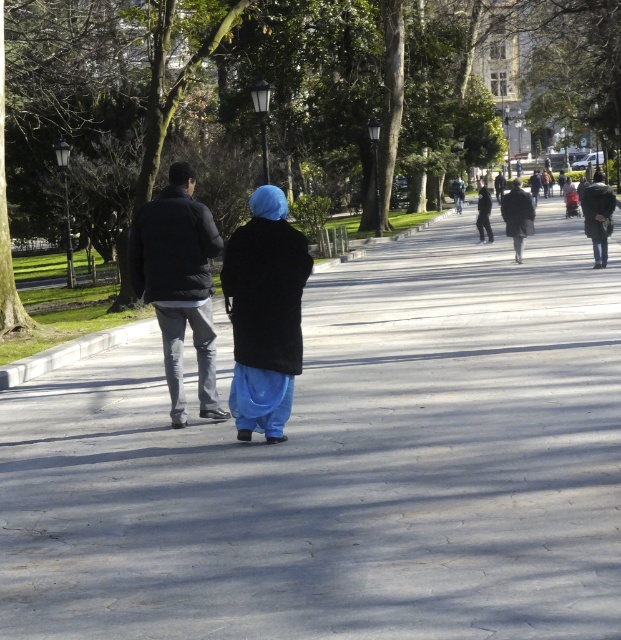
Can you confirm if green leafy tree at center is taller than dark gray jacket at center?

Indeed, green leafy tree at center has a greater height compared to dark gray jacket at center.

Image resolution: width=621 pixels, height=640 pixels. I want to click on green leafy tree at center, so click(x=283, y=96).

What are the coordinates of `green leafy tree at center` in the screenshot? It's located at (283, 96).

Between point (217, 410) and point (514, 237), which one is positioned behind?

Positioned behind is point (514, 237).

Is dark gray jacket at center to the right of dark gray coat at center from the viewer's perspective?

Incorrect, dark gray jacket at center is not on the right side of dark gray coat at center.

Who is more forward, (156,228) or (530,211)?

Positioned in front is point (156,228).

This screenshot has width=621, height=640. Identify the location of dark gray jacket at center. (178, 284).

Measure the distance between green leafy tree at center and camera.

The distance of green leafy tree at center from camera is 54.43 feet.

From the picture: Is green leafy tree at center above green fabric jacket at center?

Indeed, green leafy tree at center is positioned over green fabric jacket at center.

Between point (279, 49) and point (453, 180), which one is positioned in front?

Point (279, 49)

Locate an element on the screen. This screenshot has height=640, width=621. green leafy tree at center is located at coordinates (x=283, y=96).